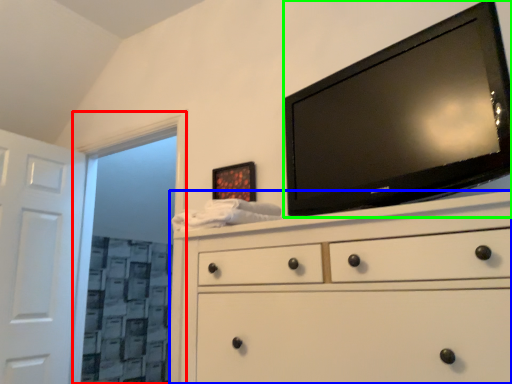
Question: Which object is the closest to the glass door (highlighted by a red box)? Choose among these: chest of drawers (highlighted by a blue box) or television (highlighted by a green box).

Choices:
 (A) chest of drawers
 (B) television

Answer: (B)